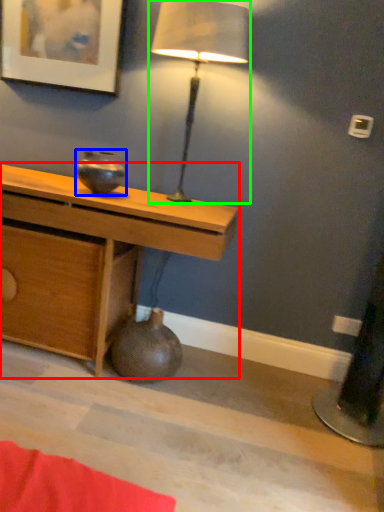
Question: Which is nearer to the desk (highlighted by a red box)? vase (highlighted by a blue box) or lamp (highlighted by a green box).

Choices:
 (A) vase
 (B) lamp

Answer: (A)